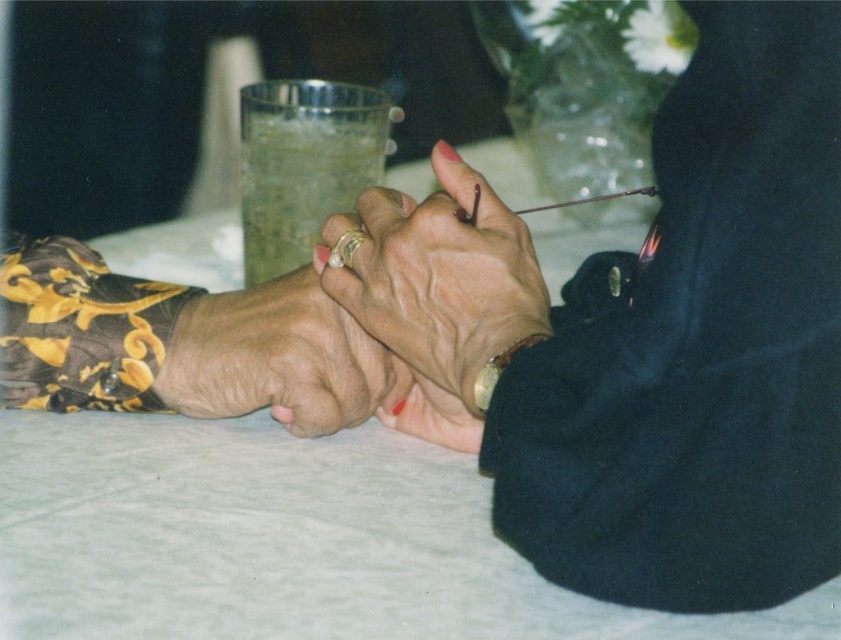
Question: Does dry skin hand at center appear on the right side of translucent glass cup at center?

Choices:
 (A) no
 (B) yes

Answer: (B)

Question: Which point is closer to the camera taking this photo?

Choices:
 (A) (706, 403)
 (B) (257, 202)
 (C) (503, 365)
 (D) (334, 253)

Answer: (A)

Question: Which of these objects is positioned farthest from the matte gold ring at center?

Choices:
 (A) smooth black sweater at center
 (B) translucent glass cup at center
 (C) gold metallic bracelet at lower right

Answer: (B)

Question: Which point is closer to the camera?

Choices:
 (A) (506, 355)
 (B) (226, 380)

Answer: (A)

Question: Can you confirm if dry skin hand at center is wider than gold metallic bracelet at lower right?

Choices:
 (A) yes
 (B) no

Answer: (A)

Question: Is translucent glass cup at center to the left of gold metallic bracelet at lower right from the viewer's perspective?

Choices:
 (A) yes
 (B) no

Answer: (A)